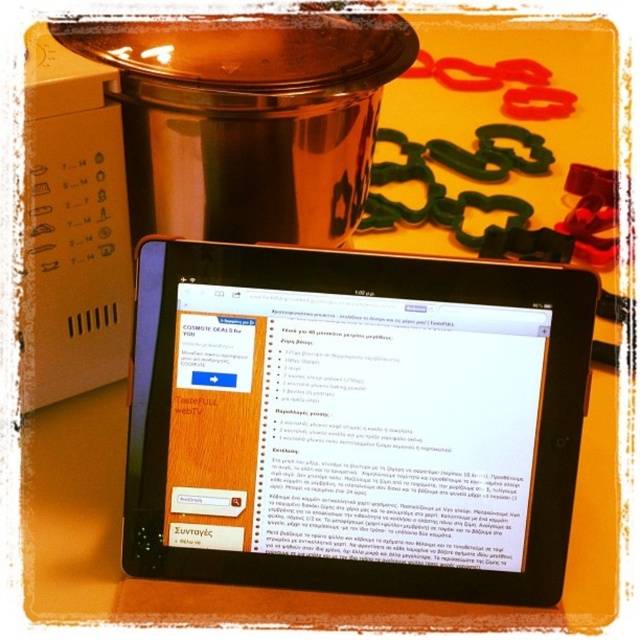
Who is more forward, [515,298] or [109,246]?

Point [515,298]

Who is positioned more to the left, black glossy tablet at center or white plastic microwave at left?

white plastic microwave at left

Which is in front, point (500, 333) or point (45, 81)?

Positioned in front is point (45, 81).

Where is `black glossy tablet at center`? This screenshot has height=640, width=640. black glossy tablet at center is located at coordinates (355, 420).